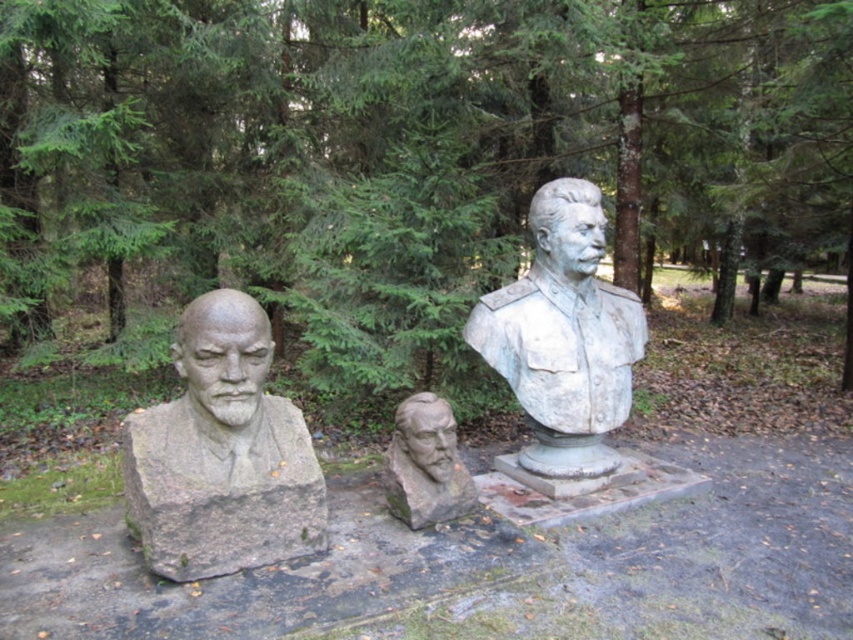
Question: Considering the real-world distances, which object is farthest from the green textured tree at center?

Choices:
 (A) gray stone bust at center
 (B) stone textured bust at center

Answer: (A)

Question: Among these objects, which one is nearest to the camera?

Choices:
 (A) stone textured bust at center
 (B) green textured tree at center

Answer: (A)

Question: Can you confirm if green textured tree at center is positioned to the left of gray stone bust at left?

Choices:
 (A) yes
 (B) no

Answer: (B)

Question: Is gray stone bust at left bigger than stone textured bust at center?

Choices:
 (A) no
 (B) yes

Answer: (B)

Question: Which point appears farthest from the camera in this image?

Choices:
 (A) (514, 305)
 (B) (263, 461)
 (C) (409, 474)

Answer: (A)

Question: Where is green textured tree at center located in relation to stone textured bust at center in the image?

Choices:
 (A) right
 (B) left

Answer: (B)